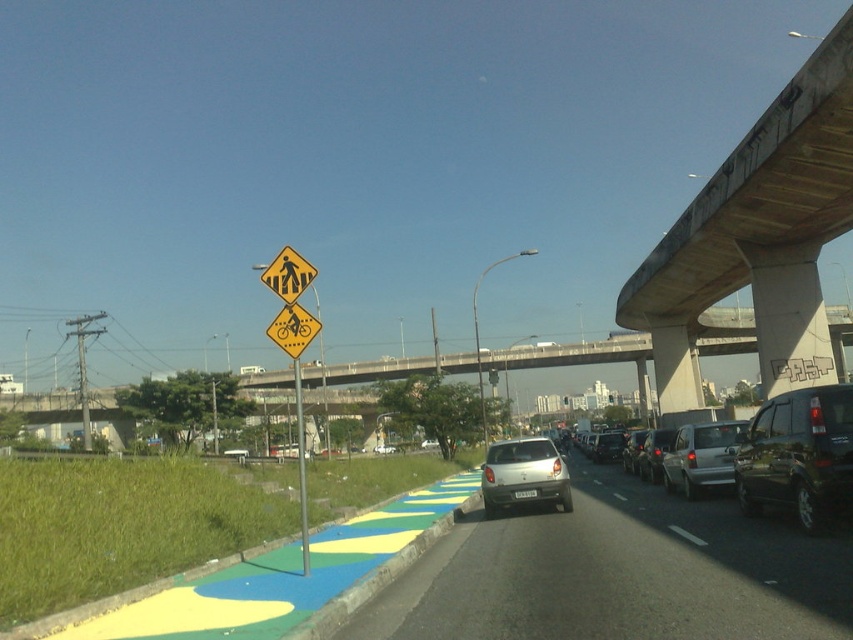
Question: Which of the following is the closest to the observer?

Choices:
 (A) silver metallic car at center
 (B) silver metallic sedan at center-right
 (C) yellow plastic pedestrian crossing sign at upper center

Answer: (A)

Question: Is silver metallic sedan at center-right bigger than metallic silver sedan at center?

Choices:
 (A) no
 (B) yes

Answer: (A)

Question: Is yellow plastic pedestrian crossing sign at upper center to the right of shiny black car at center from the viewer's perspective?

Choices:
 (A) yes
 (B) no

Answer: (B)

Question: In this image, where is yellow diamond-shaped bicycle at upper center located relative to satin silver sedan at center?

Choices:
 (A) above
 (B) below

Answer: (A)

Question: Which of the following is the farthest from the observer?

Choices:
 (A) (517, 492)
 (B) (699, 476)
 (C) (309, 321)

Answer: (B)

Question: Which point is closer to the camera taking this photo?

Choices:
 (A) (663, 483)
 (B) (643, 442)

Answer: (A)